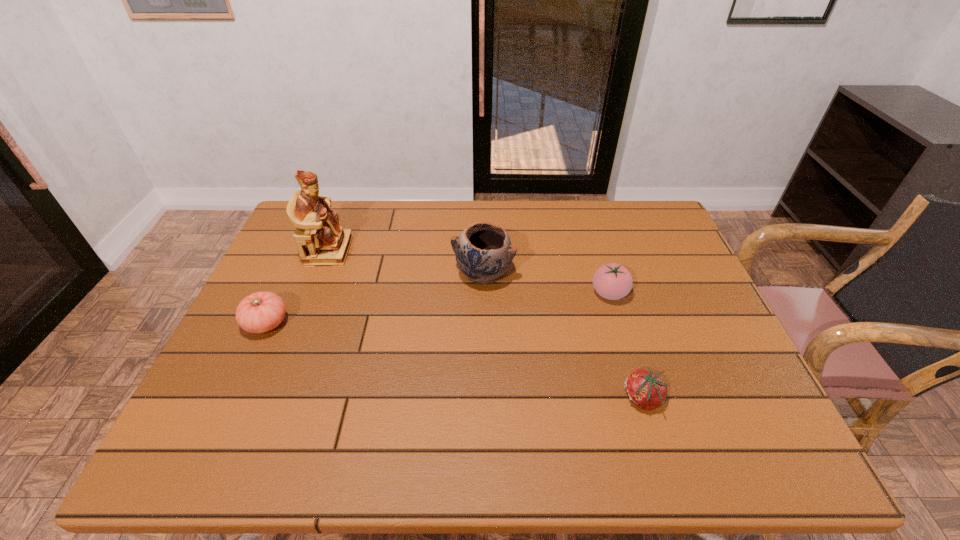
In order to click on object located in the far edge section of the desktop in this screenshot , I will do `click(320, 240)`.

In order to click on figurine located in the left edge section of the desktop in this screenshot , I will do `click(320, 240)`.

I want to click on tomato that is at the left edge, so click(x=260, y=312).

The height and width of the screenshot is (540, 960). I want to click on object that is at the far left corner, so click(320, 240).

The image size is (960, 540). What are the coordinates of `vacant space at the far edge` in the screenshot? It's located at [x=401, y=240].

Where is `vacant space at the near edge of the desktop`? The width and height of the screenshot is (960, 540). vacant space at the near edge of the desktop is located at coordinates (x=479, y=458).

Where is `vacant space at the left edge`? This screenshot has height=540, width=960. vacant space at the left edge is located at coordinates (288, 294).

In the image, there is a desktop. Identify the location of vacant space at the right edge. The height and width of the screenshot is (540, 960). (687, 362).

You are a GUI agent. You are given a task and a screenshot of the screen. Output one action in this format:
    pyautogui.click(x=<x>, y=<y>)
    Task: Click on the blank area at the far right corner
    
    Given the screenshot: What is the action you would take?
    pyautogui.click(x=666, y=234)

Image resolution: width=960 pixels, height=540 pixels. I want to click on free space at the near right corner, so click(727, 433).